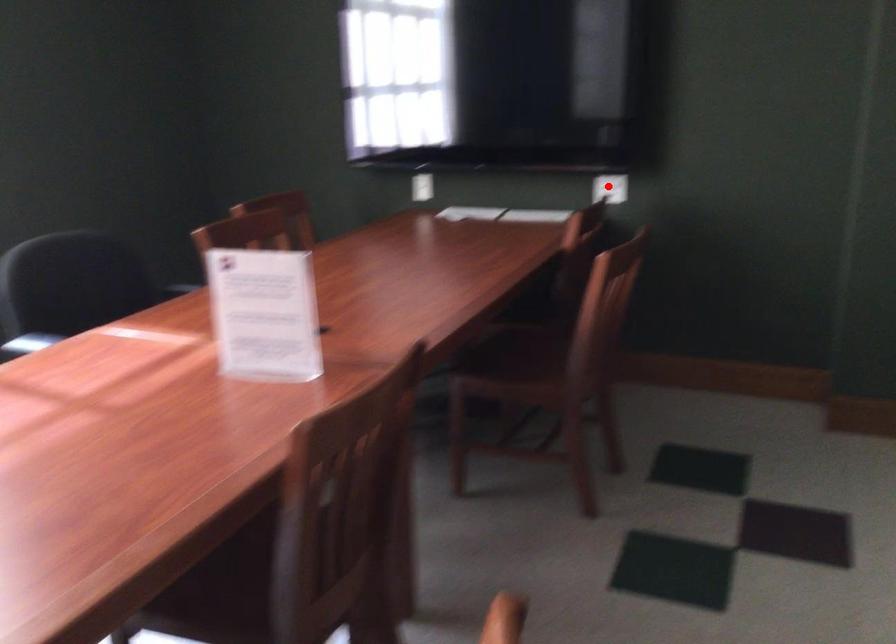
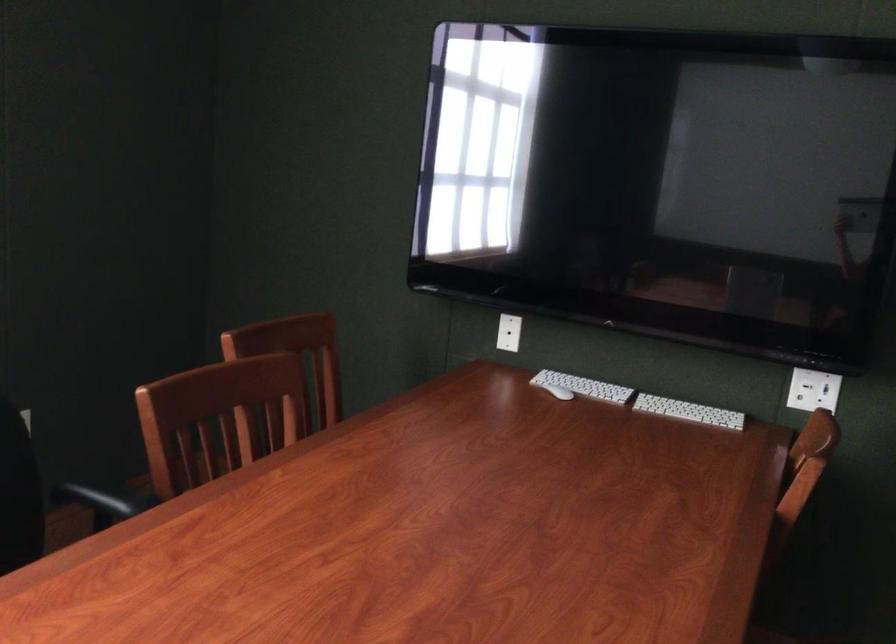
Question: I am providing you with two images of the same scene from different viewpoints. In image1, a red point is highlighted. Considering the same 3D point in image2, which of the following is correct?

Choices:
 (A) It is closer
 (B) It is farther

Answer: (A)